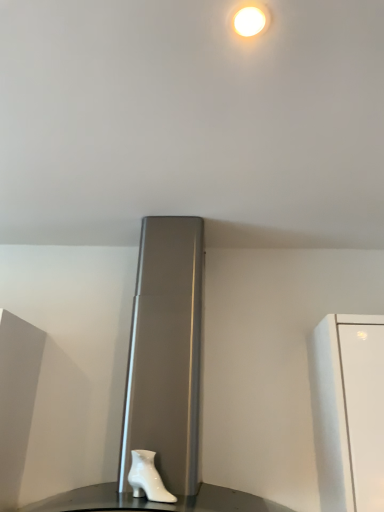
What do you see at coordinates (147, 478) in the screenshot? I see `white glossy boot at lower center` at bounding box center [147, 478].

This screenshot has height=512, width=384. Identify the location of white glossy boot at lower center. (147, 478).

You are a GUI agent. You are given a task and a screenshot of the screen. Output one action in this format:
    pyautogui.click(x=<x>, y=<y>)
    Task: Click on the white glossy boot at lower center
    The width and height of the screenshot is (384, 512).
    Given the screenshot: What is the action you would take?
    pyautogui.click(x=147, y=478)